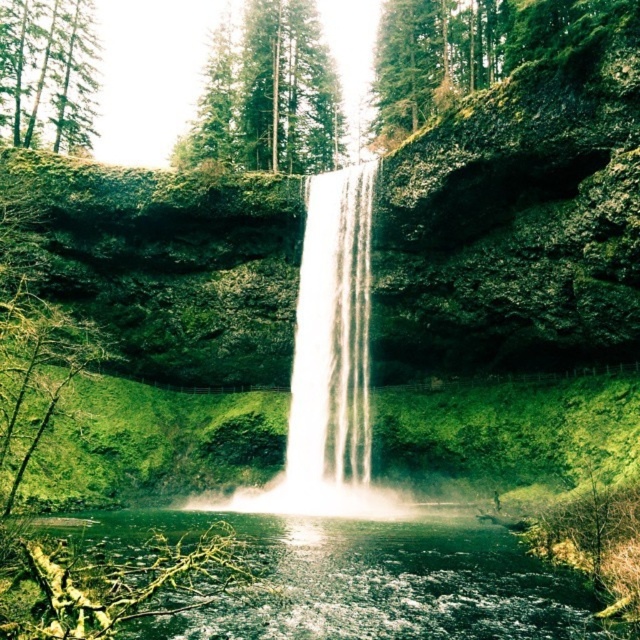
Between point (456, 612) and point (280, 122), which one is positioned behind?

Positioned behind is point (280, 122).

Which is below, clear water at center or green textured tree at upper center?

clear water at center is below.

Between point (380, 532) and point (272, 154), which one is positioned behind?

The point (272, 154) is behind.

Find the location of a particular element. This screenshot has height=640, width=640. clear water at center is located at coordinates (360, 579).

Who is higher up, clear water at center or green matte tree at upper left?

green matte tree at upper left is above.

Between clear water at center and green matte tree at upper left, which one has more height?

With more height is green matte tree at upper left.

The width and height of the screenshot is (640, 640). Identify the location of clear water at center. (360, 579).

The width and height of the screenshot is (640, 640). What are the coordinates of `clear water at center` in the screenshot? It's located at (360, 579).

Is point (360, 240) in front of point (72, 136)?

Yes.

Does white translucent water at center appear on the left side of green matte tree at upper left?

No, white translucent water at center is not to the left of green matte tree at upper left.

Between point (337, 408) and point (56, 131), which one is positioned in front?

Point (337, 408) is more forward.

The width and height of the screenshot is (640, 640). Find the location of `white translucent water at center`. white translucent water at center is located at coordinates (332, 333).